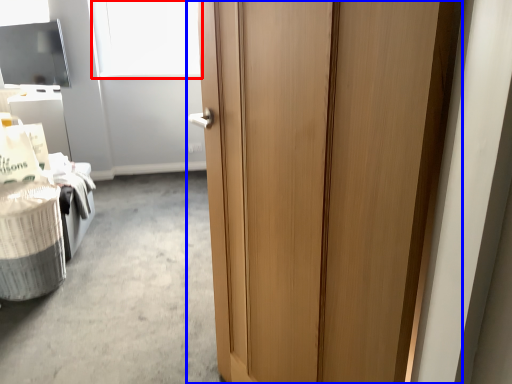
Question: Which object is further to the camera taking this photo, window screen (highlighted by a red box) or door (highlighted by a blue box)?

Choices:
 (A) window screen
 (B) door

Answer: (A)